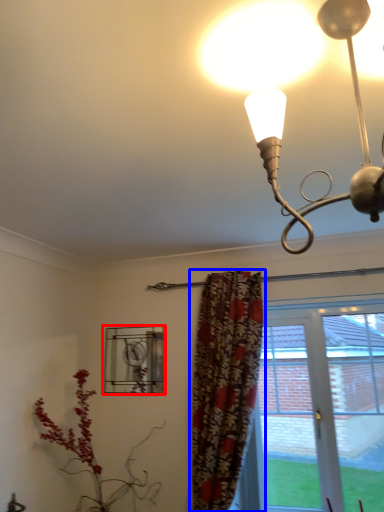
Question: Which object is further to the camera taking this photo, window (highlighted by a red box) or curtain (highlighted by a blue box)?

Choices:
 (A) window
 (B) curtain

Answer: (A)